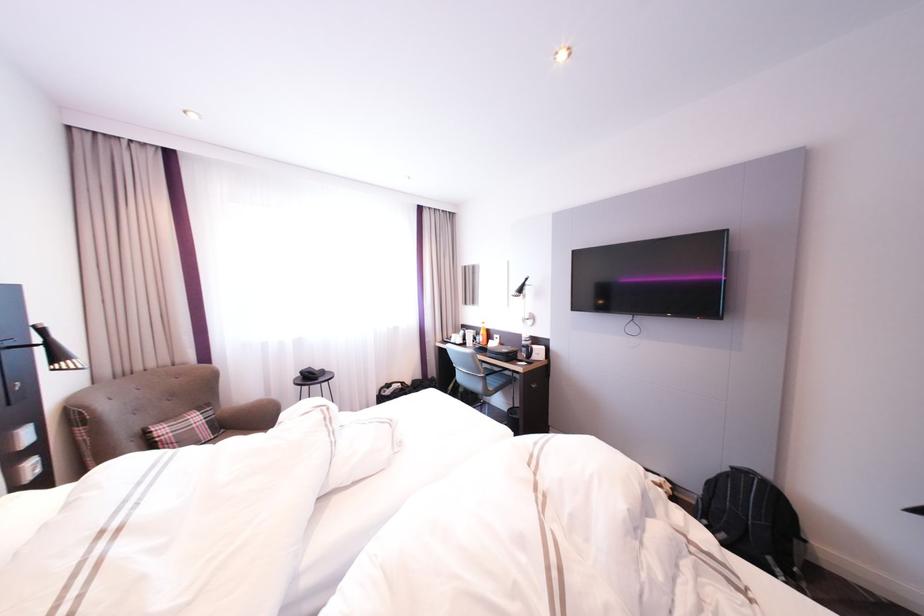
Locate an element on the screen. white tissue box is located at coordinates (26, 469).